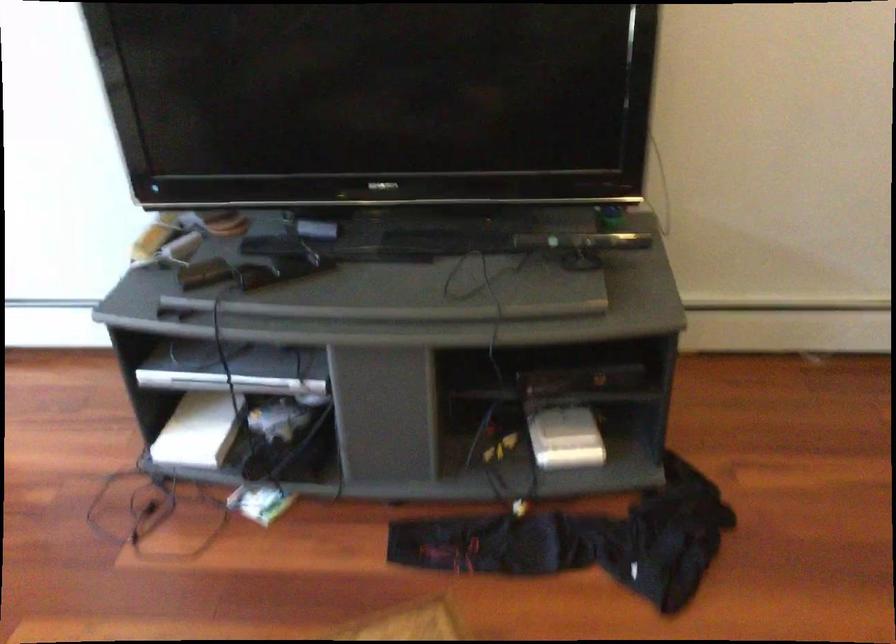
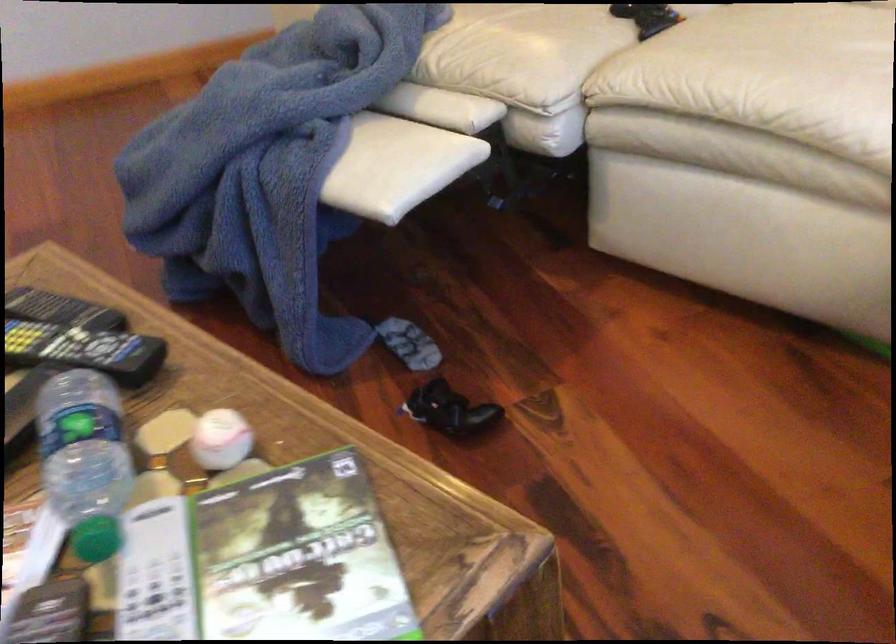
How did the camera likely rotate?

The camera's rotation is toward right-down.